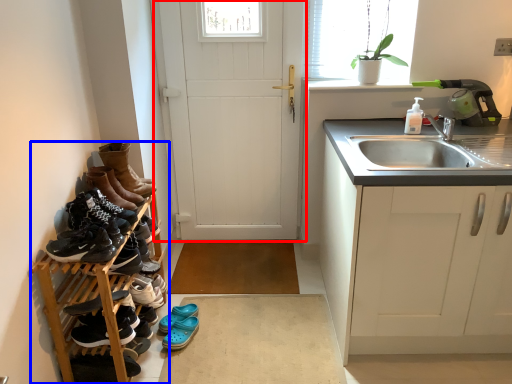
Question: Which point is further to the camera, door (highlighted by a red box) or carpetry (highlighted by a blue box)?

Choices:
 (A) door
 (B) carpetry

Answer: (A)